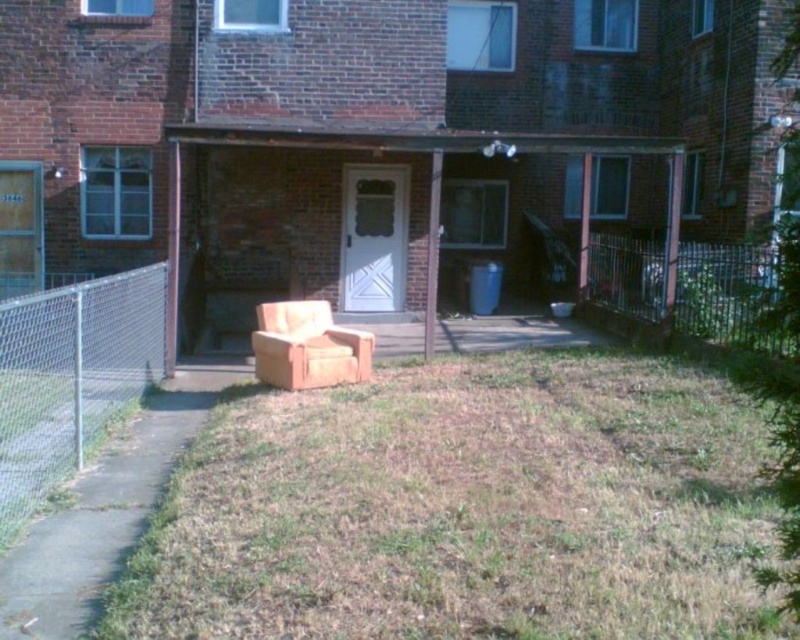
Based on the photo, is metallic chain-link fence at right thinner than beige fabric chair at center?

Yes, metallic chain-link fence at right is thinner than beige fabric chair at center.

Between metallic chain-link fence at right and beige fabric chair at center, which one appears on the right side from the viewer's perspective?

From the viewer's perspective, metallic chain-link fence at right appears more on the right side.

Which is behind, point (642, 248) or point (300, 326)?

Positioned behind is point (642, 248).

I want to click on metallic chain-link fence at right, so click(728, 294).

Between metal chain-link fence at left and metallic chain-link fence at right, which one has more height?

metal chain-link fence at left is taller.

Locate an element on the screen. metal chain-link fence at left is located at coordinates (72, 378).

The height and width of the screenshot is (640, 800). Find the location of `metal chain-link fence at left`. metal chain-link fence at left is located at coordinates [x=72, y=378].

Can you confirm if metal chain-link fence at left is positioned to the left of beige fabric chair at center?

Yes, metal chain-link fence at left is to the left of beige fabric chair at center.

Between metal chain-link fence at left and beige fabric chair at center, which one appears on the right side from the viewer's perspective?

Positioned to the right is beige fabric chair at center.

Who is more forward, [40,332] or [328,365]?

Point [40,332]

The height and width of the screenshot is (640, 800). I want to click on metal chain-link fence at left, so click(x=72, y=378).